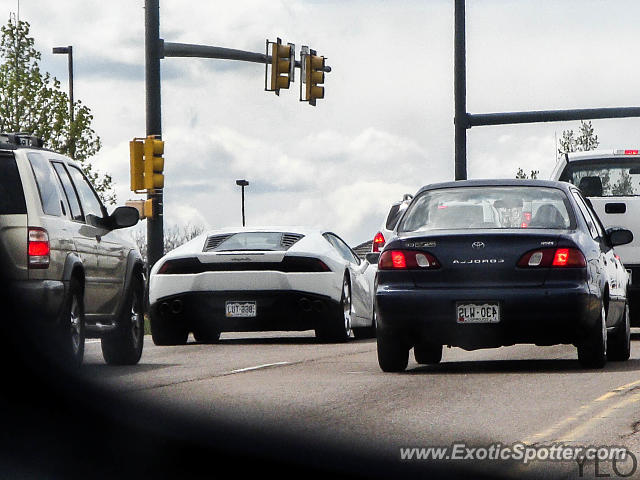
Where is `glass window`? The height and width of the screenshot is (480, 640). glass window is located at coordinates (262, 239), (491, 207), (44, 190), (68, 186), (80, 187).